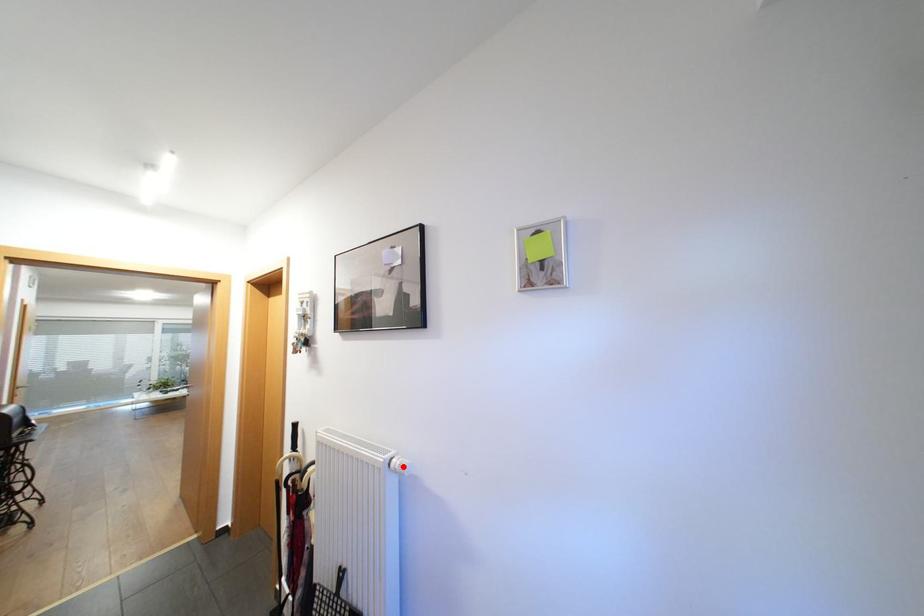
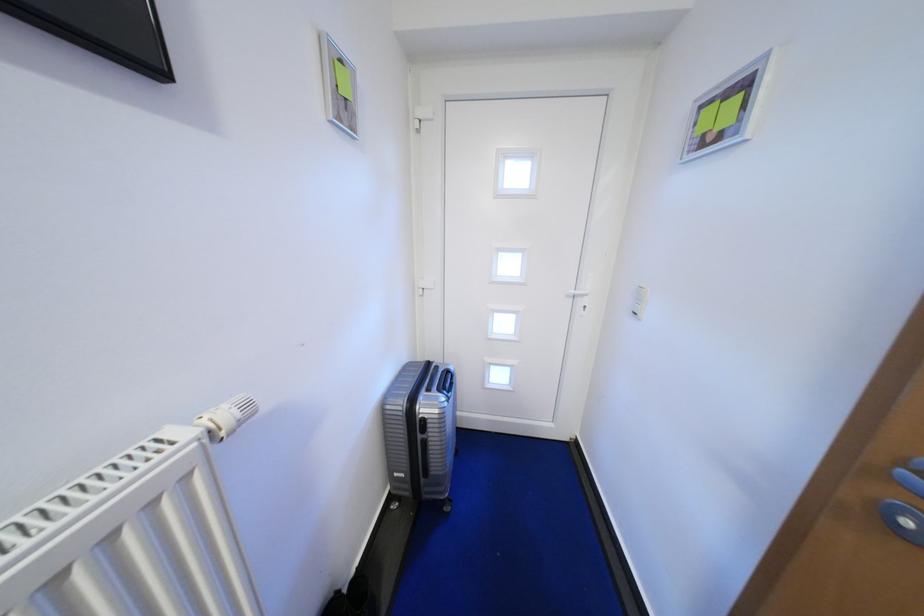
The point at the highlighted location is marked in the first image. Where is the corresponding point in the second image?

(245, 416)